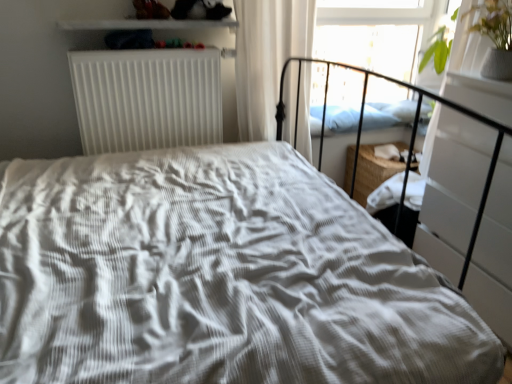
Question: From their relative heights in the image, would you say transparent glass window screen at upper right is taller or shorter than white glossy shelf at upper center?

Choices:
 (A) short
 (B) tall

Answer: (B)

Question: From the image's perspective, relative to white glossy shelf at upper center, is transparent glass window screen at upper right above or below?

Choices:
 (A) above
 (B) below

Answer: (A)

Question: Which is farther from the white glossy shelf at upper center?

Choices:
 (A) white sheer curtain at upper right
 (B) transparent glass window screen at upper right
 (C) blue soft pillow at upper right
 (D) white matte radiator at upper left

Answer: (B)

Question: Which object is positioned farthest from the white sheer curtain at upper right?

Choices:
 (A) transparent glass window screen at upper right
 (B) white matte radiator at upper left
 (C) white glossy shelf at upper center
 (D) blue soft pillow at upper right

Answer: (A)